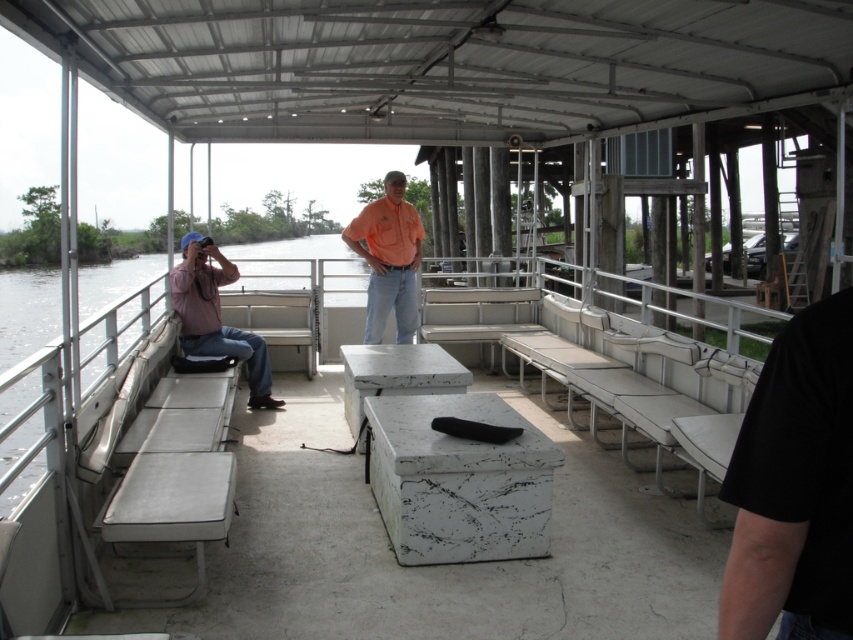
Question: Estimate the real-world distances between objects in this image. Which object is closer to the white fabric bench at center?

Choices:
 (A) orange cotton shirt at center
 (B) matte pink shirt at left
 (C) white marble picnic table at center

Answer: (B)

Question: Which of these objects is positioned closest to the matte pink shirt at left?

Choices:
 (A) orange cotton shirt at center
 (B) white fabric bench at center

Answer: (B)

Question: Does white marble picnic table at center have a smaller size compared to white fabric bench at center?

Choices:
 (A) yes
 (B) no

Answer: (B)

Question: Is orange cotton shirt at center behind white marble picnic table at center?

Choices:
 (A) yes
 (B) no

Answer: (A)

Question: Based on their relative distances, which object is farther from the white marble picnic table at center?

Choices:
 (A) matte pink shirt at left
 (B) orange cotton shirt at center
 (C) white fabric bench at center

Answer: (C)

Question: Is orange cotton shirt at center positioned at the back of white marble picnic table at center?

Choices:
 (A) no
 (B) yes

Answer: (B)